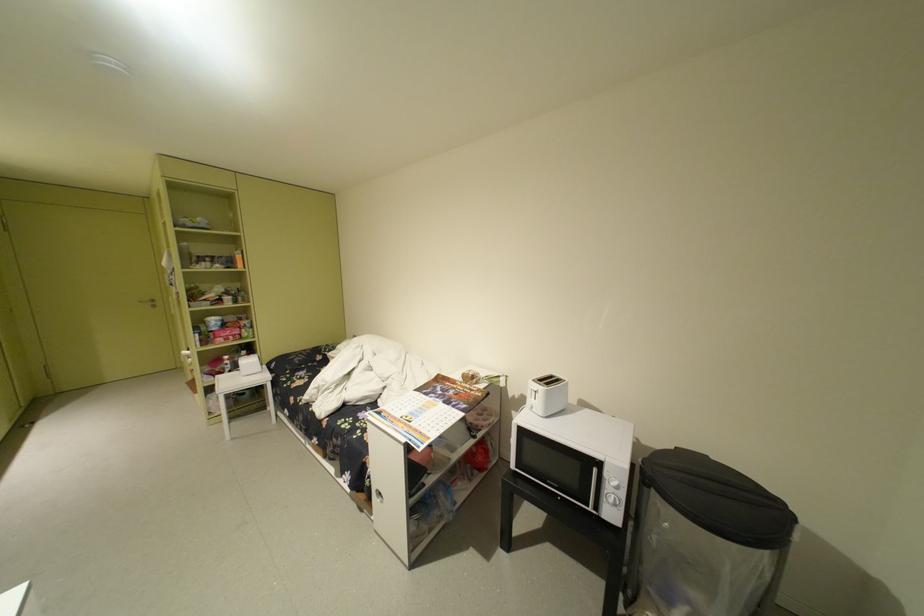
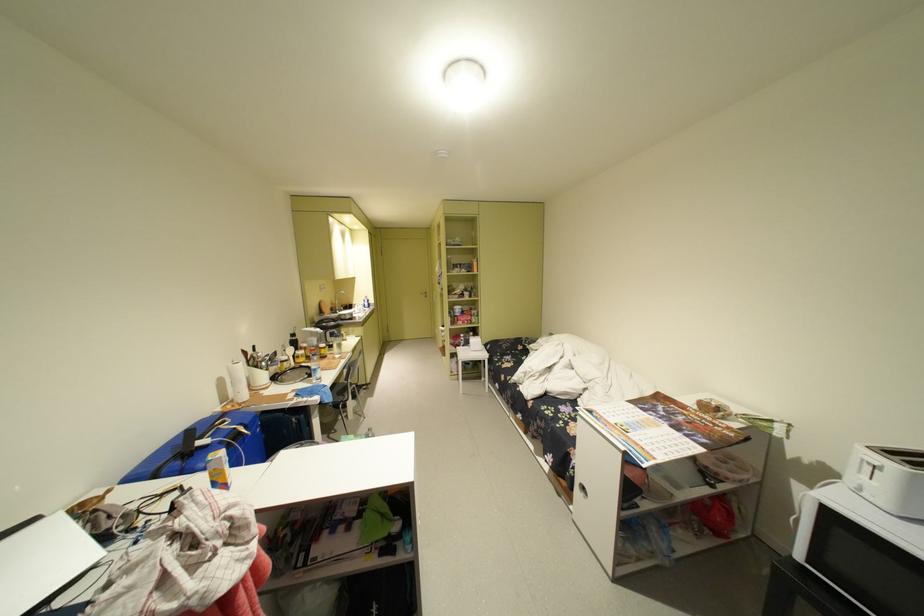
The point at [544,391] is marked in the first image. Where is the corresponding point in the second image?

(881, 464)